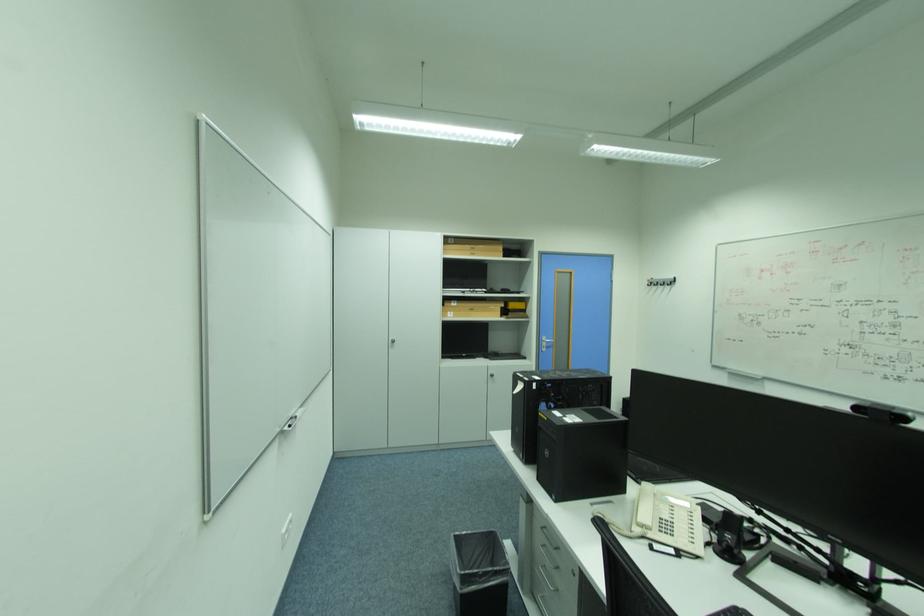
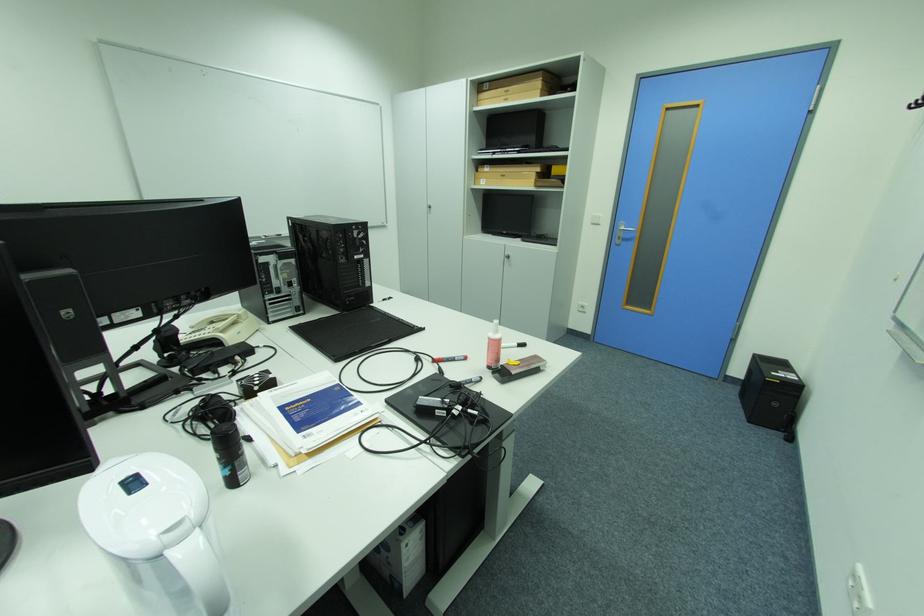
The point at (x=456, y=313) is marked in the first image. Where is the corresponding point in the second image?

(490, 180)